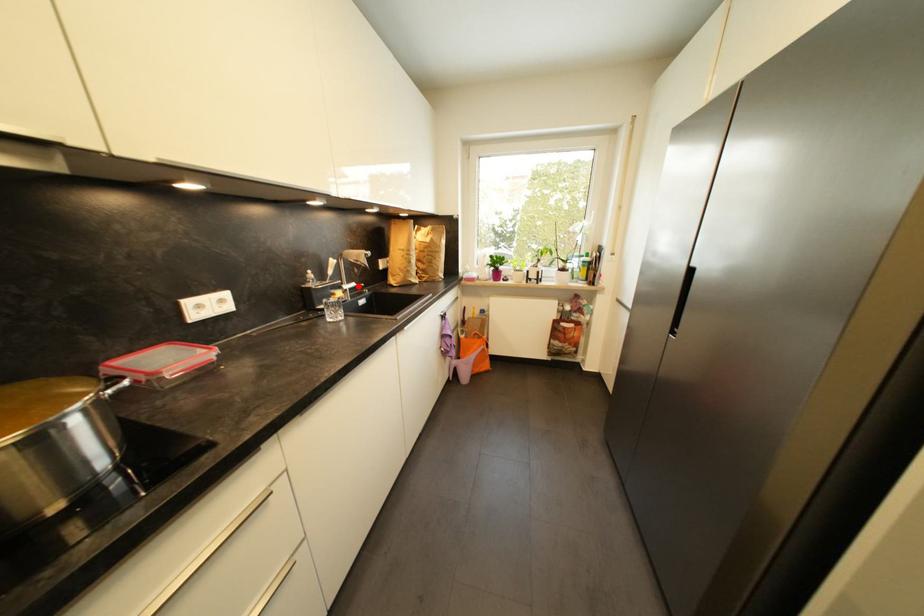
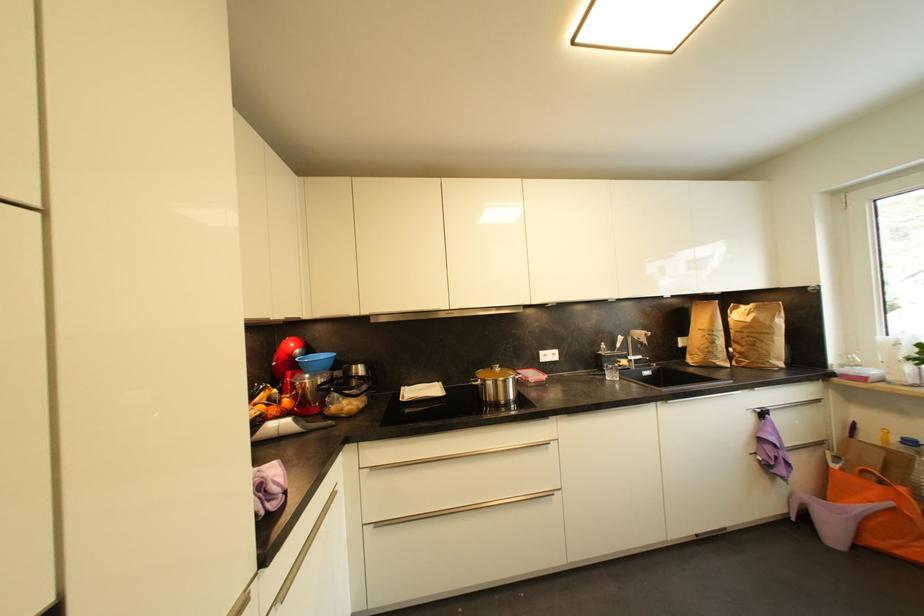
Question: I am providing you with two images of the same scene from different viewpoints. A red point is shown in image1. For the corresponding object point in image2, is it positioned nearer or farther from the camera?

Choices:
 (A) Nearer
 (B) Farther

Answer: (B)